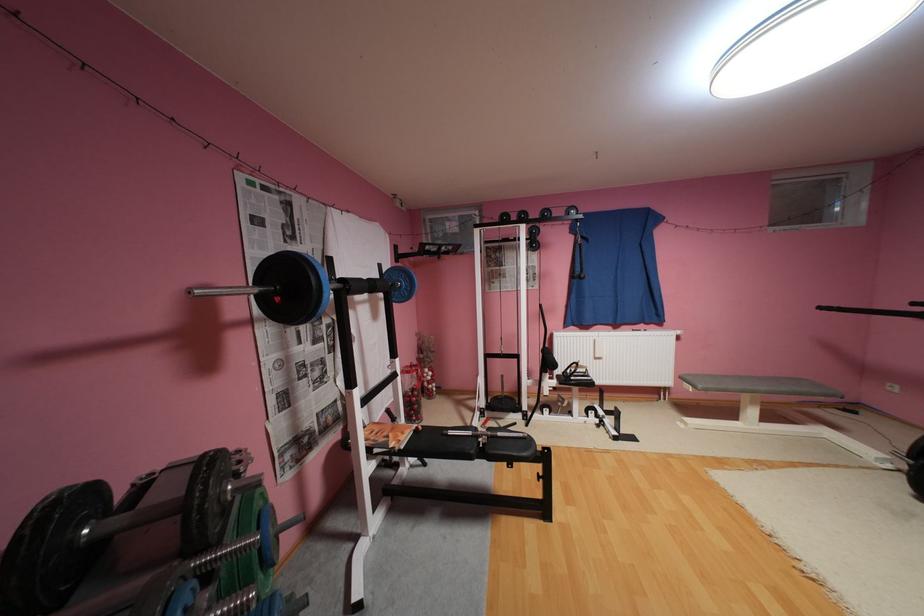
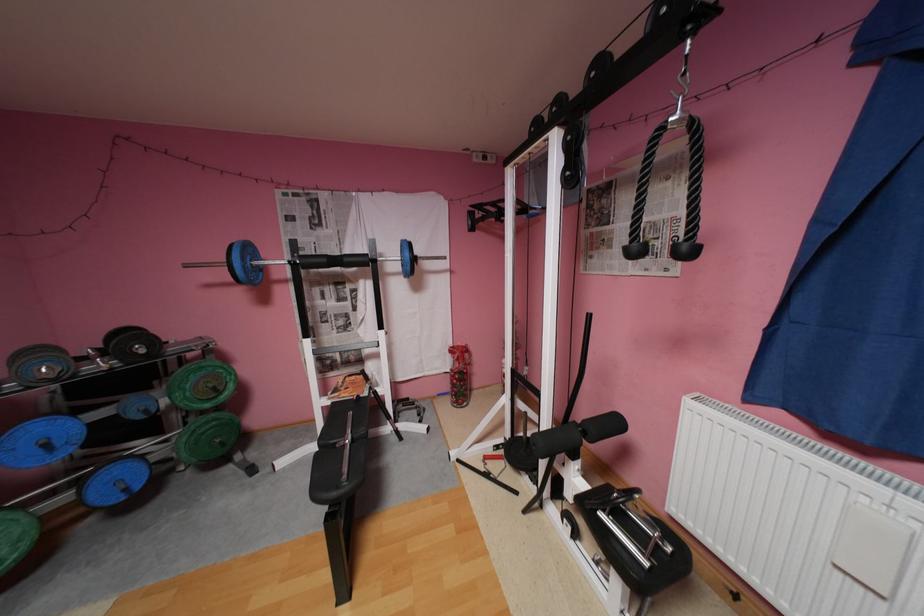
In the second image, find the point that corresponds to [380,477] in the first image.

(333, 408)